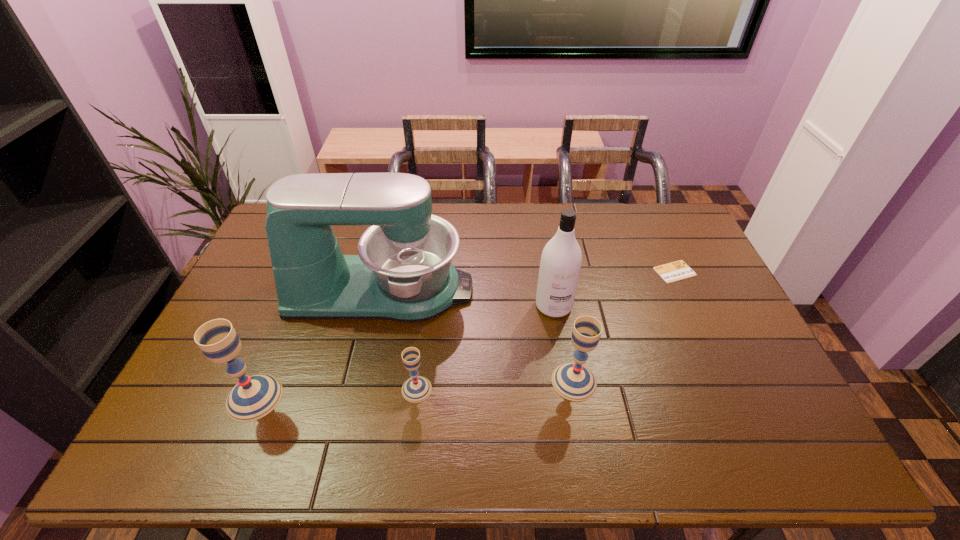
You are a GUI agent. You are given a task and a screenshot of the screen. Output one action in this format:
    pyautogui.click(x=<x>, y=<y>)
    Task: Click on the free space at the right edge
    
    Given the screenshot: What is the action you would take?
    [x=712, y=286]

In the image, there is a desktop. At what (x,y) coordinates should I click in order to perform the action: click on vacant space at the far right corner. Please return your answer as a coordinate pair (x, y). This screenshot has height=540, width=960. Looking at the image, I should click on (663, 222).

Locate an element on the screen. vacant point located between the second shortest object and the mixer is located at coordinates (399, 340).

Identify the location of vacant space that is in between the shortest chalice and the rightmost object. (545, 330).

At what (x,y) coordinates should I click in order to perform the action: click on vacant space that's between the shortest chalice and the second shortest chalice. Please return your answer as a coordinate pair (x, y). The height and width of the screenshot is (540, 960). Looking at the image, I should click on (495, 385).

Where is `free space that is in between the mixer and the rightmost chalice`? The image size is (960, 540). free space that is in between the mixer and the rightmost chalice is located at coordinates (478, 336).

I want to click on vacant space that is in between the second shortest chalice and the identity card, so click(x=624, y=327).

Image resolution: width=960 pixels, height=540 pixels. I want to click on free space between the leftmost chalice and the shortest chalice, so click(336, 393).

The height and width of the screenshot is (540, 960). Identify the location of vacant region between the leftmost chalice and the second chalice from right to left. (336, 393).

Image resolution: width=960 pixels, height=540 pixels. Find the location of `the second closest object to the second shortest chalice`. the second closest object to the second shortest chalice is located at coordinates (403, 272).